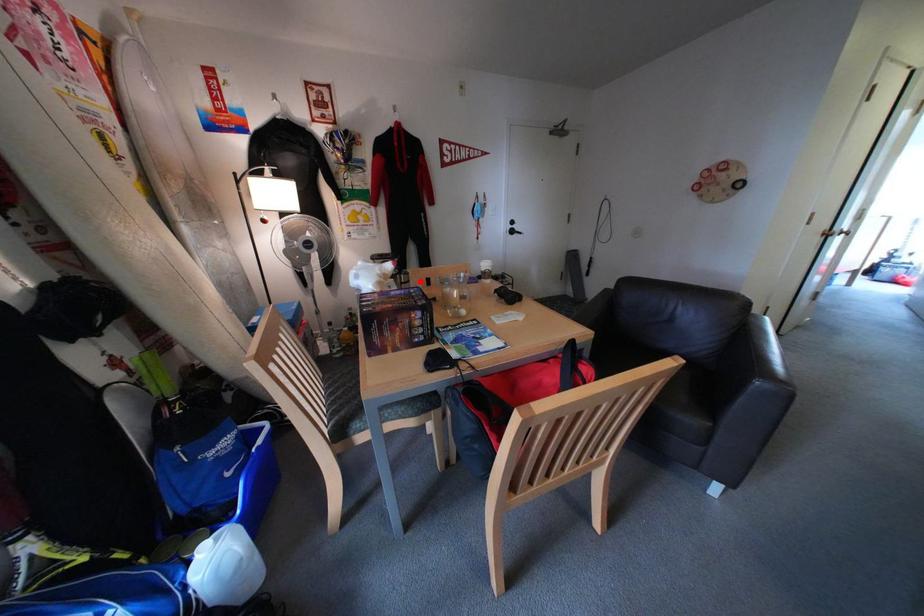
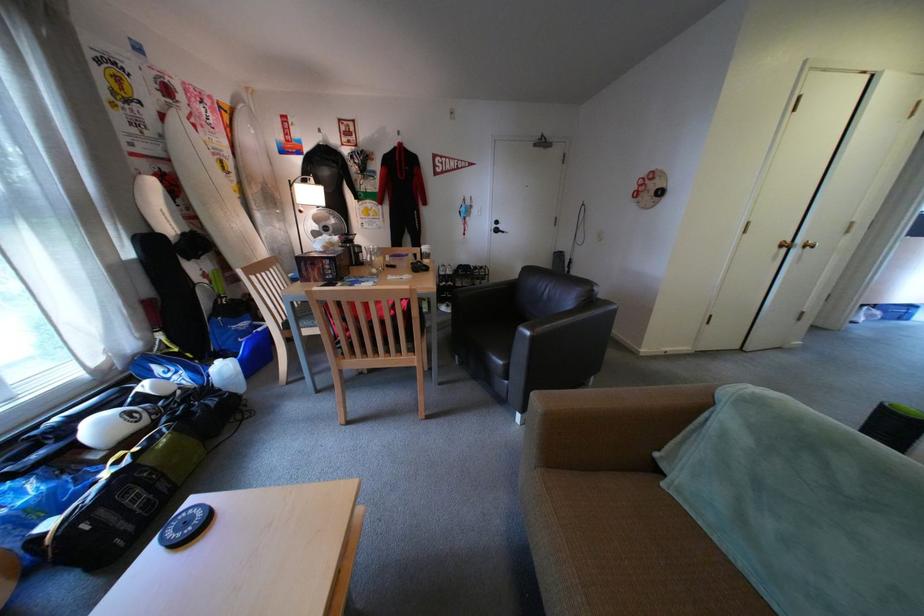
Where in the second image is the point corresponding to the highlighted location from the first image?

(373, 253)